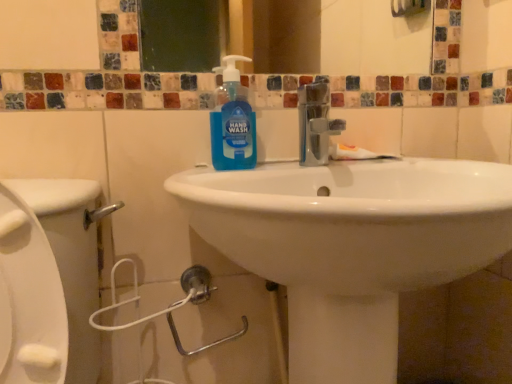
Question: Is white matte toothpaste at center wider or thinner than blue translucent hand wash at center?

Choices:
 (A) wide
 (B) thin

Answer: (B)

Question: Considering the relative positions of white matte toothpaste at center and blue translucent hand wash at center in the image provided, is white matte toothpaste at center to the left or to the right of blue translucent hand wash at center?

Choices:
 (A) left
 (B) right

Answer: (B)

Question: Estimate the real-world distances between objects in this image. Which object is closer to the white glossy sink at center?

Choices:
 (A) white matte toothpaste at center
 (B) blue translucent hand wash at center

Answer: (B)

Question: Which is farther from the white glossy sink at center?

Choices:
 (A) blue translucent hand wash at center
 (B) white matte toothpaste at center

Answer: (B)